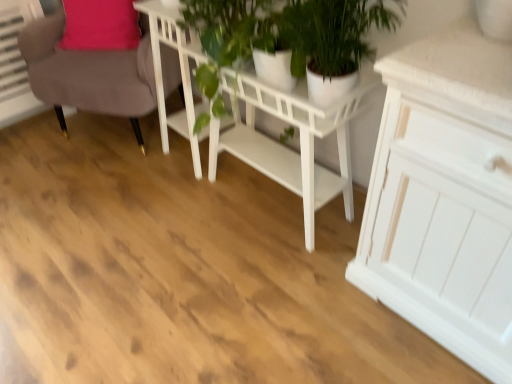
Question: Could you tell me if green leafy plant at center is turned towards white glossy pot at center?

Choices:
 (A) yes
 (B) no

Answer: (B)

Question: Considering the relative sizes of green leafy plant at center and white glossy pot at center in the image provided, is green leafy plant at center wider than white glossy pot at center?

Choices:
 (A) yes
 (B) no

Answer: (B)

Question: Is green leafy plant at center closer to the viewer compared to white glossy pot at center?

Choices:
 (A) no
 (B) yes

Answer: (A)

Question: Is there a large distance between green leafy plant at center and white glossy pot at center?

Choices:
 (A) no
 (B) yes

Answer: (A)

Question: Does green leafy plant at center have a greater height compared to white glossy pot at center?

Choices:
 (A) yes
 (B) no

Answer: (B)

Question: Relative to white glossy pot at center, is white glossy table at center, which is counted as the first table, starting from the right, in front or behind?

Choices:
 (A) front
 (B) behind

Answer: (B)

Question: From a real-world perspective, is white glossy table at center, which is counted as the first table, starting from the right, physically located above or below white glossy pot at center?

Choices:
 (A) above
 (B) below

Answer: (B)

Question: Is white glossy table at center, which is counted as the first table, starting from the right, bigger or smaller than white glossy pot at center?

Choices:
 (A) small
 (B) big

Answer: (B)

Question: Does point (188, 132) appear closer or farther from the camera than point (396, 4)?

Choices:
 (A) farther
 (B) closer

Answer: (A)

Question: Visually, is white wooden table at center, placed as the second table when sorted from right to left, positioned to the left or to the right of white glossy pot at center?

Choices:
 (A) left
 (B) right

Answer: (A)

Question: Considering the positions of white wooden table at center, placed as the second table when sorted from right to left, and white glossy pot at center in the image, is white wooden table at center, placed as the second table when sorted from right to left, bigger or smaller than white glossy pot at center?

Choices:
 (A) small
 (B) big

Answer: (A)

Question: From a real-world perspective, is white wooden table at center, placed as the 1th table when sorted from left to right, positioned above or below white glossy pot at center?

Choices:
 (A) above
 (B) below

Answer: (B)

Question: Considering the positions of point (159, 23) and point (240, 13), is point (159, 23) closer or farther from the camera than point (240, 13)?

Choices:
 (A) farther
 (B) closer

Answer: (A)

Question: Would you say green leafy plant at center is to the left or to the right of white wooden table at center, placed as the 1th table when sorted from left to right, in the picture?

Choices:
 (A) left
 (B) right

Answer: (B)

Question: From a real-world perspective, is green leafy plant at center above or below white wooden table at center, placed as the second table when sorted from right to left?

Choices:
 (A) above
 (B) below

Answer: (A)